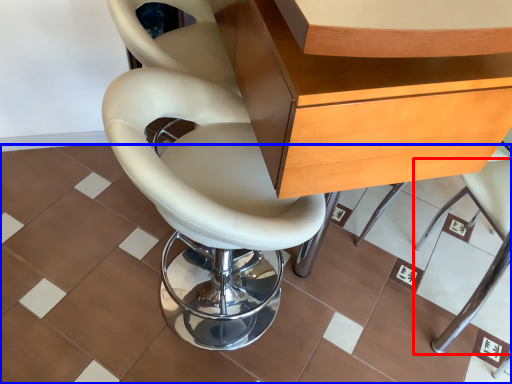
Question: Among these objects, which one is farthest to the camera, chair (highlighted by a red box) or ceramic tile (highlighted by a blue box)?

Choices:
 (A) chair
 (B) ceramic tile

Answer: (B)